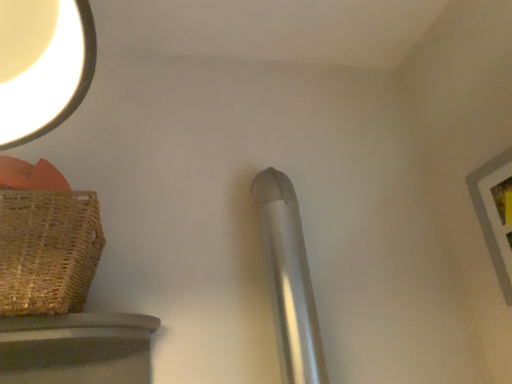
I want to click on silver metallic pipe at center, so pyautogui.click(x=289, y=279).

Are wooden picture frame at upper right and brown woven basket at left making contact?

wooden picture frame at upper right and brown woven basket at left are not in contact.

Is wooden picture frame at upper right located outside brown woven basket at left?

Indeed, wooden picture frame at upper right is completely outside brown woven basket at left.

Find the location of a particular element. The height and width of the screenshot is (384, 512). picture frame that appears behind the brown woven basket at left is located at coordinates (495, 214).

Is brown woven basket at left far away from wooden picture frame at upper right?

No, brown woven basket at left is not far away from wooden picture frame at upper right.

From a real-world perspective, is brown woven basket at left positioned above or below wooden picture frame at upper right?

From a real-world perspective, brown woven basket at left is physically above wooden picture frame at upper right.

Is brown woven basket at left aimed at wooden picture frame at upper right?

No.

How much distance is there between brown woven basket at left and wooden picture frame at upper right?

A distance of 38.35 inches exists between brown woven basket at left and wooden picture frame at upper right.

How different are the orientations of silver metallic pipe at center and brown woven basket at left in degrees?

0.429 degrees.

Between silver metallic pipe at center and brown woven basket at left, which one has less height?

Standing shorter between the two is brown woven basket at left.

Does silver metallic pipe at center lie behind brown woven basket at left?

Yes.

Is silver metallic pipe at center to the left or to the right of brown woven basket at left in the image?

Based on their positions, silver metallic pipe at center is located to the right of brown woven basket at left.

Can you tell me how much wooden picture frame at upper right and silver metallic pipe at center differ in facing direction?

wooden picture frame at upper right and silver metallic pipe at center are facing 90.1 degrees away from each other.

What are the coordinates of `steel that is below the wooden picture frame at upper right (from the image's perspective)` in the screenshot? It's located at (289, 279).

Considering the sizes of wooden picture frame at upper right and silver metallic pipe at center in the image, is wooden picture frame at upper right wider or thinner than silver metallic pipe at center?

In the image, wooden picture frame at upper right appears to be more narrow than silver metallic pipe at center.

Looking at the image, does wooden picture frame at upper right seem bigger or smaller compared to silver metallic pipe at center?

wooden picture frame at upper right is smaller than silver metallic pipe at center.

Based on the photo, what's the angular difference between brown woven basket at left and silver metallic pipe at center's facing directions?

There is a 0.429-degree angle between the facing directions of brown woven basket at left and silver metallic pipe at center.

Considering the relative sizes of brown woven basket at left and silver metallic pipe at center in the image provided, is brown woven basket at left wider than silver metallic pipe at center?

Yes, brown woven basket at left is wider than silver metallic pipe at center.

Is brown woven basket at left positioned before silver metallic pipe at center?

Yes, the depth of brown woven basket at left is less than that of silver metallic pipe at center.

From the image's perspective, between brown woven basket at left and silver metallic pipe at center, who is located below?

From the image's view, silver metallic pipe at center is below.

Could you tell me if silver metallic pipe at center is facing wooden picture frame at upper right?

No, silver metallic pipe at center is not oriented towards wooden picture frame at upper right.

Is silver metallic pipe at center inside the boundaries of wooden picture frame at upper right, or outside?

silver metallic pipe at center is not inside wooden picture frame at upper right, it's outside.

Locate an element on the screen. The image size is (512, 384). picture frame that appears above the silver metallic pipe at center (from the image's perspective) is located at coordinates pos(495,214).

Considering the positions of points (265, 174) and (494, 240), is point (265, 174) closer to camera compared to point (494, 240)?

That is False.

Where is `basket in front of the wooden picture frame at upper right`? This screenshot has height=384, width=512. basket in front of the wooden picture frame at upper right is located at coordinates (48, 250).

Find the location of a particular element. This screenshot has height=384, width=512. picture frame behind the brown woven basket at left is located at coordinates (495, 214).

Looking at the image, which one is located further to brown woven basket at left, wooden picture frame at upper right or silver metallic pipe at center?

wooden picture frame at upper right lies further to brown woven basket at left than the other object.

Considering their positions, is wooden picture frame at upper right positioned further to silver metallic pipe at center than brown woven basket at left?

Based on the image, wooden picture frame at upper right appears to be further to silver metallic pipe at center.

Which object lies further to the anchor point silver metallic pipe at center, brown woven basket at left or wooden picture frame at upper right?

The object further to silver metallic pipe at center is wooden picture frame at upper right.

Estimate the real-world distances between objects in this image. Which object is closer to wooden picture frame at upper right, brown woven basket at left or silver metallic pipe at center?

The object closer to wooden picture frame at upper right is silver metallic pipe at center.

Based on their spatial positions, is silver metallic pipe at center or wooden picture frame at upper right closer to brown woven basket at left?

silver metallic pipe at center is closer to brown woven basket at left.

From the image, which object appears to be nearer to wooden picture frame at upper right, silver metallic pipe at center or brown woven basket at left?

silver metallic pipe at center lies closer to wooden picture frame at upper right than the other object.

Locate an element on the screen. This screenshot has width=512, height=384. steel between brown woven basket at left and wooden picture frame at upper right from left to right is located at coordinates (289, 279).